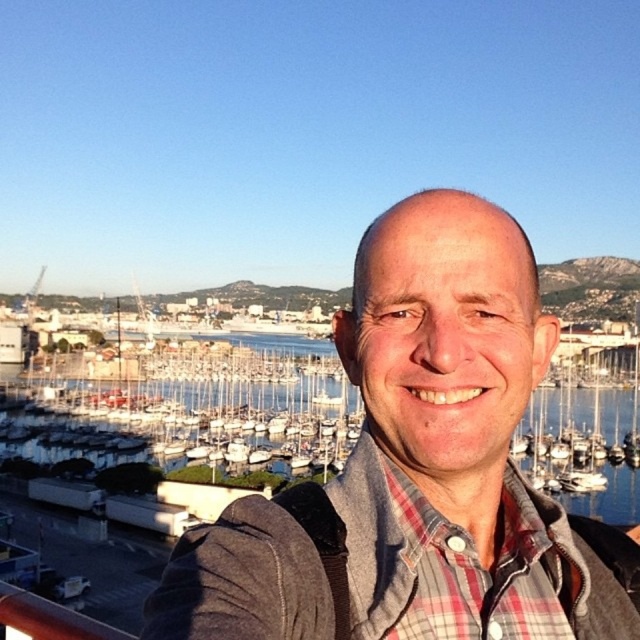
Which is more to the left, gray fabric jacket at center or blue water at center?

Positioned to the left is gray fabric jacket at center.

Consider the image. Is gray fabric jacket at center closer to camera compared to blue water at center?

That is True.

The image size is (640, 640). Describe the element at coordinates (413, 467) in the screenshot. I see `gray fabric jacket at center` at that location.

The image size is (640, 640). I want to click on gray fabric jacket at center, so (x=413, y=467).